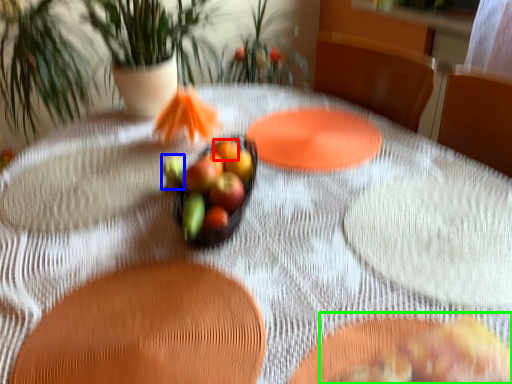
Question: Which object is the closest to the fruit (highlighted by a red box)? Choose among these: fruit (highlighted by a blue box) or food (highlighted by a green box).

Choices:
 (A) fruit
 (B) food

Answer: (A)